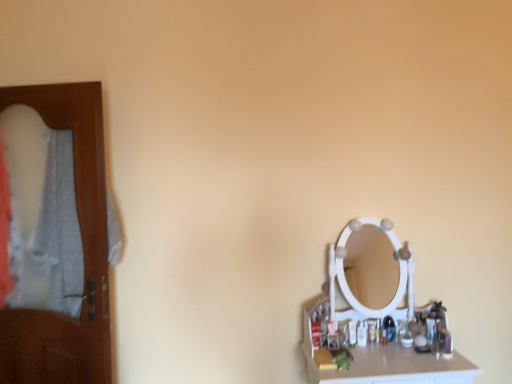
Question: In the image, is brown wooden door at left positioned in front of or behind translucent plastic bottle at right?

Choices:
 (A) front
 (B) behind

Answer: (A)

Question: Visually, is brown wooden door at left positioned to the left or to the right of translucent plastic bottle at right?

Choices:
 (A) left
 (B) right

Answer: (A)

Question: Which object is positioned closest to the brown wooden door at left?

Choices:
 (A) white glossy counter top at lower right
 (B) translucent plastic bottle at right

Answer: (A)

Question: Based on their relative distances, which object is farther from the white glossy counter top at lower right?

Choices:
 (A) translucent plastic bottle at right
 (B) brown wooden door at left

Answer: (B)